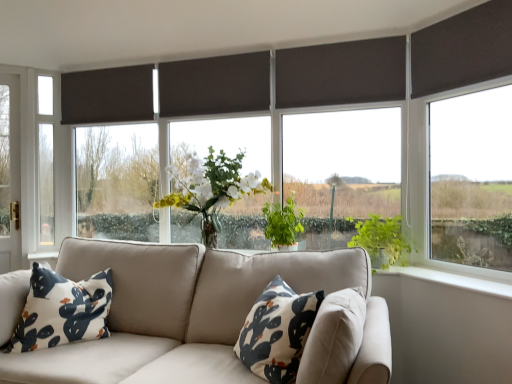
The width and height of the screenshot is (512, 384). What do you see at coordinates (62, 310) in the screenshot?
I see `white fabric pillow at lower left, arranged as the second pillow when viewed from the right` at bounding box center [62, 310].

Find the location of a particular element. dark brown fabric blind at upper right is located at coordinates (463, 49).

In order to face dark grey fabric at upper center, which appears as the 1th curtain when viewed from the right, should I rotate leftwards or rightwards?

A 11.089 degree turn to the right will do.

How much space does dark grey fabric at upper center, which is counted as the 1th curtain, starting from the front, occupy vertically?

15.43 inches.

The image size is (512, 384). What do you see at coordinates (343, 166) in the screenshot?
I see `dark matte blind at center, the second window in the right-to-left sequence` at bounding box center [343, 166].

What is the approximate height of matte glass window at center, the 3th window viewed from the right?

The height of matte glass window at center, the 3th window viewed from the right, is 1.35 meters.

Find the location of `dark fabric window at upper right, which appears as the fourth window when viewed from the back`. dark fabric window at upper right, which appears as the fourth window when viewed from the back is located at coordinates (472, 179).

In order to click on white fabric pillow at lower left, arranged as the second pillow when viewed from the right in this screenshot , I will do [x=62, y=310].

Considering the relative positions of clear glass window at left, placed as the 1th window when sorted from left to right, and matte glass window at center, which is the third window from front to back, in the image provided, is clear glass window at left, placed as the 1th window when sorted from left to right, behind matte glass window at center, which is the third window from front to back,?

Yes, clear glass window at left, placed as the 1th window when sorted from left to right, is behind matte glass window at center, which is the third window from front to back.

Is clear glass window at left, the fourth window when ordered from front to back, at the right side of matte glass window at center, which is the 2th window from back to front?

No, clear glass window at left, the fourth window when ordered from front to back, is not to the right of matte glass window at center, which is the 2th window from back to front.

Looking at the image, does clear glass window at left, the fourth window when ordered from front to back, seem bigger or smaller compared to matte glass window at center, which is the 2th window from back to front?

Considering their sizes, clear glass window at left, the fourth window when ordered from front to back, takes up less space than matte glass window at center, which is the 2th window from back to front.

In the scene shown: From the image's perspective, is clear glass window at left, the fourth window when ordered from front to back, over matte glass window at center, the 3th window viewed from the right?

Actually, clear glass window at left, the fourth window when ordered from front to back, appears below matte glass window at center, the 3th window viewed from the right, in the image.

How many degrees apart are the facing directions of green leafy plant at right, which is counted as the 1th vegetation, starting from the right, and dark fabric window at upper right, which is the fourth window from left to right?

45.3 degrees separate the facing orientations of green leafy plant at right, which is counted as the 1th vegetation, starting from the right, and dark fabric window at upper right, which is the fourth window from left to right.

From a real-world perspective, starting from the dark fabric window at upper right, which appears as the fourth window when viewed from the back, which vegetation is the 2nd one below it? Please provide its 2D coordinates.

[(382, 241)]

Which object is closer to the camera taking this photo, green leafy plant at right, the 2th vegetation from the left, or dark fabric window at upper right, which ranks as the first window in front-to-back order?

dark fabric window at upper right, which ranks as the first window in front-to-back order, is more forward.

Could you tell me if green leafy plant at right, the 2th vegetation from the left, is turned towards dark fabric window at upper right, which ranks as the first window in front-to-back order?

No.

Does point (6, 234) come closer to viewer compared to point (196, 135)?

No, it is not.

In the scene shown: How many degrees apart are the facing directions of green leafy tree at left and matte glass window at center, the second window positioned from the left?

green leafy tree at left and matte glass window at center, the second window positioned from the left, are facing 46 degrees away from each other.

From the image's perspective, is green leafy tree at left on matte glass window at center, which is the third window from front to back?

No, from the image's perspective, green leafy tree at left is not above matte glass window at center, which is the third window from front to back.

Considering the sizes of white fabric pillow at center, the 2th pillow when ordered from left to right, and green leafy plant at right, which is counted as the 1th vegetation, starting from the right, in the image, is white fabric pillow at center, the 2th pillow when ordered from left to right, wider or thinner than green leafy plant at right, which is counted as the 1th vegetation, starting from the right,?

white fabric pillow at center, the 2th pillow when ordered from left to right, is thinner than green leafy plant at right, which is counted as the 1th vegetation, starting from the right.

Between white fabric pillow at center, the first pillow when ordered from right to left, and green leafy plant at right, which is counted as the 1th vegetation, starting from the right, which one has larger size?

white fabric pillow at center, the first pillow when ordered from right to left, is bigger.

Which vegetation is the 1st one when counting from the back of the white fabric pillow at center, the 2th pillow when ordered from left to right? Please provide its 2D coordinates.

[(382, 241)]

From the image's perspective, is white fabric pillow at center, the first pillow when ordered from right to left, over green leafy plant at right, the 2th vegetation from the left?

No, from the image's perspective, white fabric pillow at center, the first pillow when ordered from right to left, is not on top of green leafy plant at right, the 2th vegetation from the left.

Which object is positioned more to the right, white fabric pillow at lower left, the first pillow viewed from the left, or clear glass window at left, the fourth window when ordered from front to back?

white fabric pillow at lower left, the first pillow viewed from the left.

From a real-world perspective, is white fabric pillow at lower left, the first pillow viewed from the left, physically above clear glass window at left, positioned as the fourth window in right-to-left order?

No.

How different are the orientations of white fabric pillow at lower left, arranged as the second pillow when viewed from the right, and clear glass window at left, positioned as the fourth window in right-to-left order, in degrees?

white fabric pillow at lower left, arranged as the second pillow when viewed from the right, and clear glass window at left, positioned as the fourth window in right-to-left order, are facing 12.2 degrees away from each other.

From a real-world perspective, is dark brown fabric blind at upper right physically located above or below white fabric pillow at lower left, the first pillow viewed from the left?

In terms of real-world spatial position, dark brown fabric blind at upper right is above white fabric pillow at lower left, the first pillow viewed from the left.

Does dark brown fabric blind at upper right have a lesser width compared to white fabric pillow at lower left, arranged as the second pillow when viewed from the right?

Yes, dark brown fabric blind at upper right is thinner than white fabric pillow at lower left, arranged as the second pillow when viewed from the right.

Can we say dark brown fabric blind at upper right lies outside white fabric pillow at lower left, arranged as the second pillow when viewed from the right?

Absolutely, dark brown fabric blind at upper right is external to white fabric pillow at lower left, arranged as the second pillow when viewed from the right.

How far apart are dark brown fabric blind at upper right and white fabric pillow at lower left, arranged as the second pillow when viewed from the right?

dark brown fabric blind at upper right and white fabric pillow at lower left, arranged as the second pillow when viewed from the right, are 7.33 feet apart from each other.

Considering their positions, is dark grey fabric at upper center, which is the 2th curtain in back-to-front order, located in front of or behind green leafy plant at center, the first vegetation positioned from the left?

dark grey fabric at upper center, which is the 2th curtain in back-to-front order, is positioned closer to the viewer than green leafy plant at center, the first vegetation positioned from the left.

Based on the photo, from a real-world perspective, who is located lower, dark grey fabric at upper center, which is counted as the 1th curtain, starting from the front, or green leafy plant at center, which ranks as the 2th vegetation in right-to-left order?

From a 3D spatial view, green leafy plant at center, which ranks as the 2th vegetation in right-to-left order, is below.

Identify the location of vegetation on the left of dark grey fabric at upper center, which appears as the 1th curtain when viewed from the right. (283, 224).

Considering the positions of points (343, 79) and (274, 221), is point (343, 79) farther from camera compared to point (274, 221)?

No, it is not.

At what (x,y) coordinates should I click in order to perform the action: click on window behind the matte glass window at center, the second window positioned from the left. Please return your answer as a coordinate pair (x, y). This screenshot has width=512, height=384. Looking at the image, I should click on (45, 161).

You are a GUI agent. You are given a task and a screenshot of the screen. Output one action in this format:
    pyautogui.click(x=<x>, y=<y>)
    Task: Click on the 1st window above the green leafy plant at right, which is counted as the 1th vegetation, starting from the right (from a real-world perspective)
    This screenshot has width=512, height=384.
    Given the screenshot: What is the action you would take?
    pyautogui.click(x=472, y=179)

Looking at this image, estimate the real-world distances between objects in this image. Which object is closer to green leafy plant at center, the first vegetation positioned from the left, white fabric pillow at lower left, arranged as the second pillow when viewed from the right, or matte black curtain at upper left, which is the second curtain from front to back?

white fabric pillow at lower left, arranged as the second pillow when viewed from the right, is positioned closer to the anchor green leafy plant at center, the first vegetation positioned from the left.

When comparing their distances from dark brown fabric blind at upper right, does dark fabric window at upper right, which ranks as the first window in front-to-back order, or dark grey fabric at upper center, which is the 2th curtain in back-to-front order, seem closer?

dark fabric window at upper right, which ranks as the first window in front-to-back order.

From the image, which object appears to be nearer to dark matte blind at center, the second window in the right-to-left sequence, dark brown fabric blind at upper right or green leafy plant at center, which ranks as the 2th vegetation in right-to-left order?

Among the two, green leafy plant at center, which ranks as the 2th vegetation in right-to-left order, is located nearer to dark matte blind at center, the second window in the right-to-left sequence.

Based on their spatial positions, is green leafy tree at left or dark grey fabric at upper center, which appears as the 1th curtain when viewed from the right, closer to green leafy plant at center, which ranks as the 2th vegetation in right-to-left order?

Based on the image, dark grey fabric at upper center, which appears as the 1th curtain when viewed from the right, appears to be nearer to green leafy plant at center, which ranks as the 2th vegetation in right-to-left order.

From the image, which object appears to be farther from green leafy plant at center, which ranks as the 2th vegetation in right-to-left order, clear glass window at left, positioned as the fourth window in right-to-left order, or white fabric pillow at center, the first pillow when ordered from right to left?

Based on the image, clear glass window at left, positioned as the fourth window in right-to-left order, appears to be further to green leafy plant at center, which ranks as the 2th vegetation in right-to-left order.

Which object lies nearer to the anchor point dark matte blind at center, the second window in the right-to-left sequence, clear glass window at left, the fourth window when ordered from front to back, or dark brown fabric blind at upper right?

dark brown fabric blind at upper right is closer to dark matte blind at center, the second window in the right-to-left sequence.

Looking at this image, based on their spatial positions, is dark brown fabric blind at upper right or matte black curtain at upper left, which ranks as the second curtain in right-to-left order, closer to dark matte blind at center, the second window when ordered from front to back?

dark brown fabric blind at upper right is closer to dark matte blind at center, the second window when ordered from front to back.

Which object lies nearer to the anchor point green leafy plant at center, which ranks as the 2th vegetation in right-to-left order, green leafy tree at left or green leafy plant at right, which is counted as the 1th vegetation, starting from the right?

green leafy plant at right, which is counted as the 1th vegetation, starting from the right, is positioned closer to the anchor green leafy plant at center, which ranks as the 2th vegetation in right-to-left order.

Image resolution: width=512 pixels, height=384 pixels. In order to click on curtain located between matte black curtain at upper left, marked as the first curtain in a back-to-front arrangement, and dark matte blind at center, the second window in the right-to-left sequence, in the left-right direction in this screenshot , I will do `click(341, 73)`.

The height and width of the screenshot is (384, 512). Find the location of `window between green leafy tree at left and matte glass window at center, which is the third window from front to back, in the horizontal direction`. window between green leafy tree at left and matte glass window at center, which is the third window from front to back, in the horizontal direction is located at coordinates (45, 161).

You are a GUI agent. You are given a task and a screenshot of the screen. Output one action in this format:
    pyautogui.click(x=<x>, y=<y>)
    Task: Click on the pillow situated between green leafy tree at left and matte glass window at center, the second window positioned from the left, from left to right
    
    Given the screenshot: What is the action you would take?
    pyautogui.click(x=62, y=310)

The height and width of the screenshot is (384, 512). Identify the location of window between matte glass window at center, which is the third window from front to back, and green leafy plant at right, which is counted as the 1th vegetation, starting from the right. (343, 166).